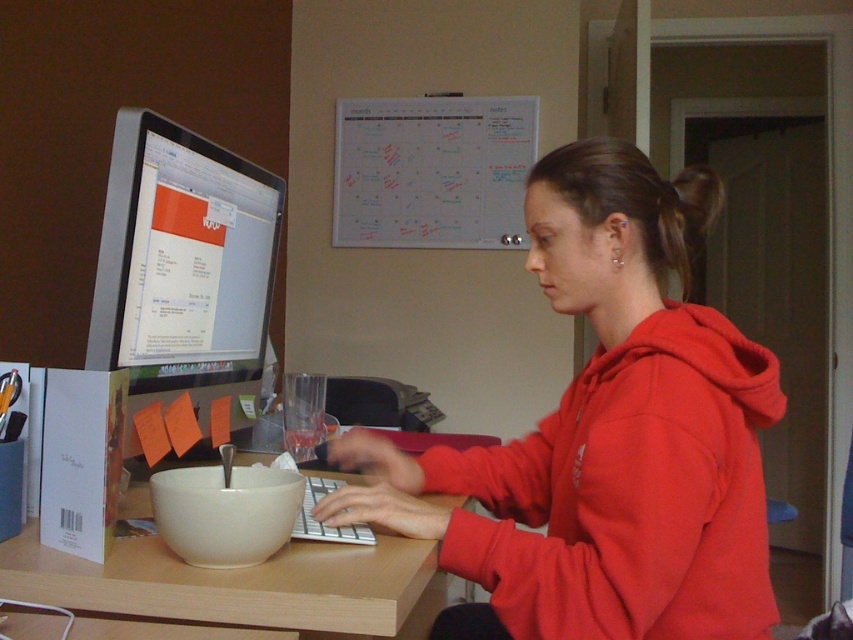
Can you confirm if red matte hoodie at center is wider than satin black monitor at left?

Indeed, red matte hoodie at center has a greater width compared to satin black monitor at left.

In order to click on red matte hoodie at center in this screenshot , I will do `click(605, 436)`.

Which is in front, point (451, 554) or point (151, 324)?

Positioned in front is point (451, 554).

I want to click on red matte hoodie at center, so click(x=605, y=436).

Who is positioned more to the left, satin black monitor at left or wooden table at center?

From the viewer's perspective, satin black monitor at left appears more on the left side.

Is satin black monitor at left smaller than wooden table at center?

Indeed, satin black monitor at left has a smaller size compared to wooden table at center.

Find the location of `satin black monitor at left`. satin black monitor at left is located at coordinates (183, 269).

Measure the distance from red matte hoodie at center to wooden table at center.

red matte hoodie at center and wooden table at center are 9.79 inches apart.

I want to click on red matte hoodie at center, so click(x=605, y=436).

Locate an element on the screen. This screenshot has height=640, width=853. red matte hoodie at center is located at coordinates (605, 436).